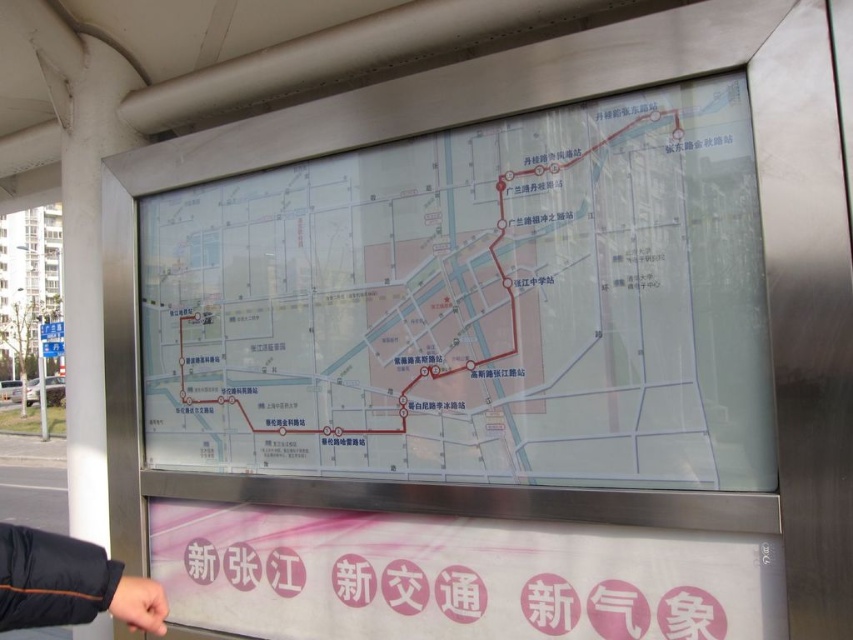
The image size is (853, 640). What do you see at coordinates (474, 305) in the screenshot?
I see `transparent plastic map at center` at bounding box center [474, 305].

How much distance is there between transparent plastic map at center and black fabric sleeve at lower left?

The distance of transparent plastic map at center from black fabric sleeve at lower left is 32.83 inches.

Describe the element at coordinates (474, 305) in the screenshot. I see `transparent plastic map at center` at that location.

Identify the location of transparent plastic map at center. Image resolution: width=853 pixels, height=640 pixels. (474, 305).